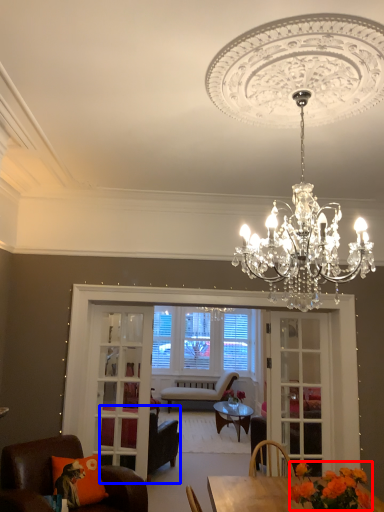
Question: Among these objects, which one is nearest to the camera, flower (highlighted by a red box) or chair (highlighted by a blue box)?

Choices:
 (A) flower
 (B) chair

Answer: (A)